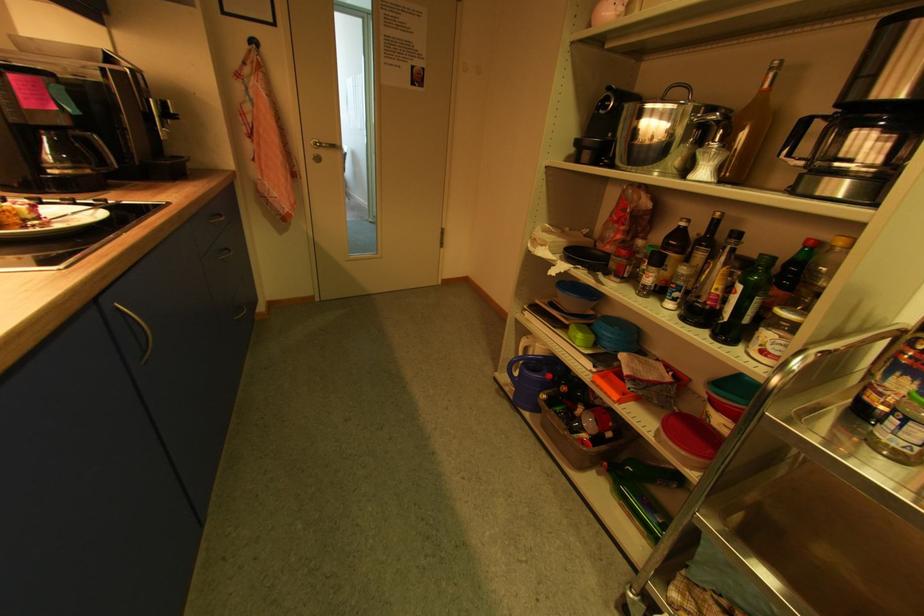
This screenshot has height=616, width=924. In order to click on glass shaker in this screenshot , I will do `click(710, 156)`.